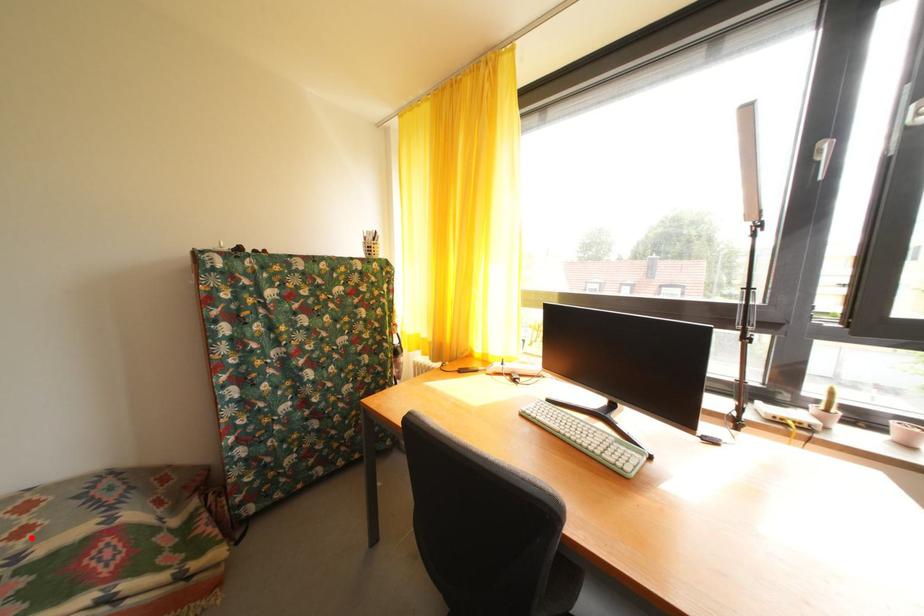
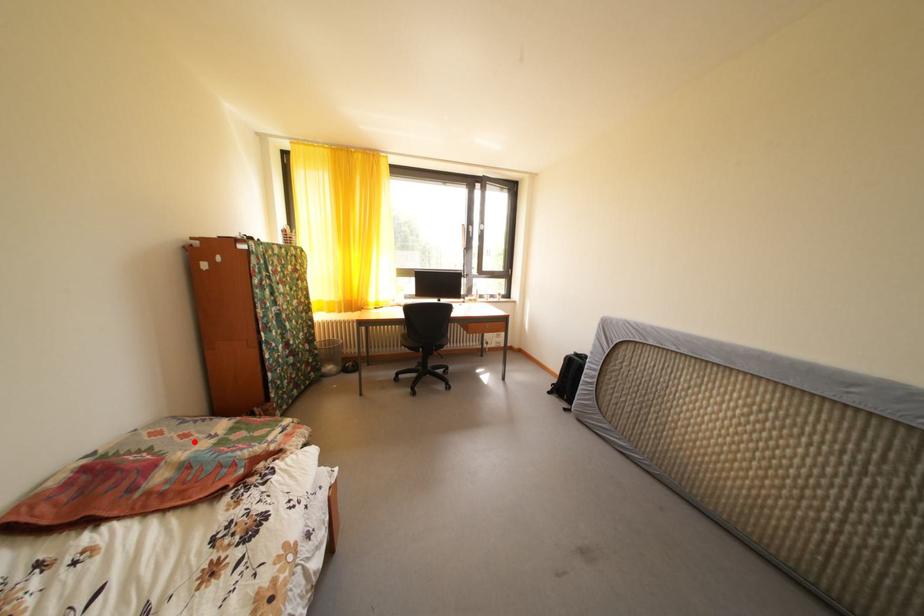
I am providing you with two images of the same scene from different viewpoints. A red point is marked on the first image and another point is marked on the second image. Does the point marked in image1 correspond to the same location as the one in image2?

Yes